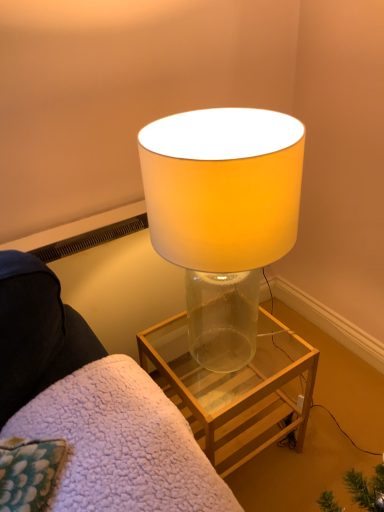
What is the approximate height of transparent glass lamp at center?

transparent glass lamp at center is 12.89 inches tall.

Describe the element at coordinates (233, 389) in the screenshot. I see `clear glass table at center` at that location.

Where is `transparent glass lamp at center`? This screenshot has height=512, width=384. transparent glass lamp at center is located at coordinates (93, 407).

Is transparent glass lamp at center wider than clear glass table at center?

Indeed, transparent glass lamp at center has a greater width compared to clear glass table at center.

Locate an element on the screen. table on the right of transparent glass lamp at center is located at coordinates (233, 389).

Considering the positions of objects transparent glass lamp at center and clear glass table at center in the image provided, who is more to the right, transparent glass lamp at center or clear glass table at center?

clear glass table at center.

What's the angular difference between clear glass table at center and translucent glass lamp at center's facing directions?

The facing directions of clear glass table at center and translucent glass lamp at center are 89.7 degrees apart.

From a real-world perspective, between clear glass table at center and translucent glass lamp at center, who is vertically higher?

translucent glass lamp at center.

Looking at the image, does clear glass table at center seem bigger or smaller compared to translucent glass lamp at center?

clear glass table at center is smaller than translucent glass lamp at center.

Is point (258, 370) positioned before point (194, 308)?

No, (258, 370) is behind (194, 308).

Is translucent glass lamp at center bigger than transparent glass lamp at center?

Indeed, translucent glass lamp at center has a larger size compared to transparent glass lamp at center.

Considering the points (281, 191) and (25, 298), which point is behind, point (281, 191) or point (25, 298)?

Positioned behind is point (25, 298).

Based on the photo, which object is further away from the camera taking this photo, translucent glass lamp at center or transparent glass lamp at center?

Positioned behind is translucent glass lamp at center.

How distant is translucent glass lamp at center from transparent glass lamp at center?

translucent glass lamp at center is 13.15 inches away from transparent glass lamp at center.

Consider the image. From the image's perspective, is transparent glass lamp at center under translucent glass lamp at center?

Indeed, from the image's perspective, transparent glass lamp at center is shown beneath translucent glass lamp at center.

Who is bigger, transparent glass lamp at center or translucent glass lamp at center?

→ With larger size is translucent glass lamp at center.

Is transparent glass lamp at center turned away from translucent glass lamp at center?

That's not correct — transparent glass lamp at center is not looking away from translucent glass lamp at center.

Can you confirm if transparent glass lamp at center is taller than translucent glass lamp at center?

Incorrect, the height of transparent glass lamp at center is not larger of that of translucent glass lamp at center.

Is clear glass table at center positioned with its back to transparent glass lamp at center?

No, clear glass table at center is not facing the opposite direction of transparent glass lamp at center.

Is clear glass table at center bigger than transparent glass lamp at center?

Yes, clear glass table at center is bigger than transparent glass lamp at center.

From the picture: From the image's perspective, between clear glass table at center and transparent glass lamp at center, which one is located above?

clear glass table at center appears higher in the image.

Which object is closer to the camera, clear glass table at center or transparent glass lamp at center?

transparent glass lamp at center is in front.

Would you say translucent glass lamp at center is outside clear glass table at center?

That's correct, translucent glass lamp at center is outside of clear glass table at center.

Is translucent glass lamp at center placed right next to clear glass table at center?

translucent glass lamp at center is not next to clear glass table at center, and they're not touching.

From the image's perspective, which object appears higher, translucent glass lamp at center or clear glass table at center?

From the image's view, translucent glass lamp at center is above.

Locate an element on the screen. This screenshot has height=512, width=384. lamp that is on the left side of clear glass table at center is located at coordinates (223, 216).

Locate an element on the screen. This screenshot has width=384, height=512. furniture that is on the left side of clear glass table at center is located at coordinates (93, 407).

This screenshot has height=512, width=384. Identify the location of table below the translucent glass lamp at center (from the image's perspective). (233, 389).

Which object lies nearer to the anchor point clear glass table at center, translucent glass lamp at center or transparent glass lamp at center?

transparent glass lamp at center is positioned closer to the anchor clear glass table at center.

Looking at the image, which one is located further to translucent glass lamp at center, transparent glass lamp at center or clear glass table at center?

clear glass table at center lies further to translucent glass lamp at center than the other object.

Estimate the real-world distances between objects in this image. Which object is further from transparent glass lamp at center, translucent glass lamp at center or clear glass table at center?

clear glass table at center is further to transparent glass lamp at center.

Considering their positions, is clear glass table at center positioned closer to translucent glass lamp at center than transparent glass lamp at center?

transparent glass lamp at center.

From the image, which object appears to be nearer to clear glass table at center, transparent glass lamp at center or translucent glass lamp at center?

Among the two, transparent glass lamp at center is located nearer to clear glass table at center.

From the image, which object appears to be farther from transparent glass lamp at center, clear glass table at center or translucent glass lamp at center?

clear glass table at center.

I want to click on lamp positioned between transparent glass lamp at center and clear glass table at center from near to far, so click(223, 216).